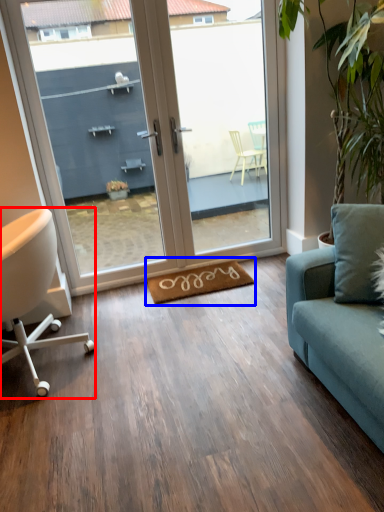
Question: Among these objects, which one is nearest to the camera, chair (highlighted by a red box) or yoga mat (highlighted by a blue box)?

Choices:
 (A) chair
 (B) yoga mat

Answer: (A)